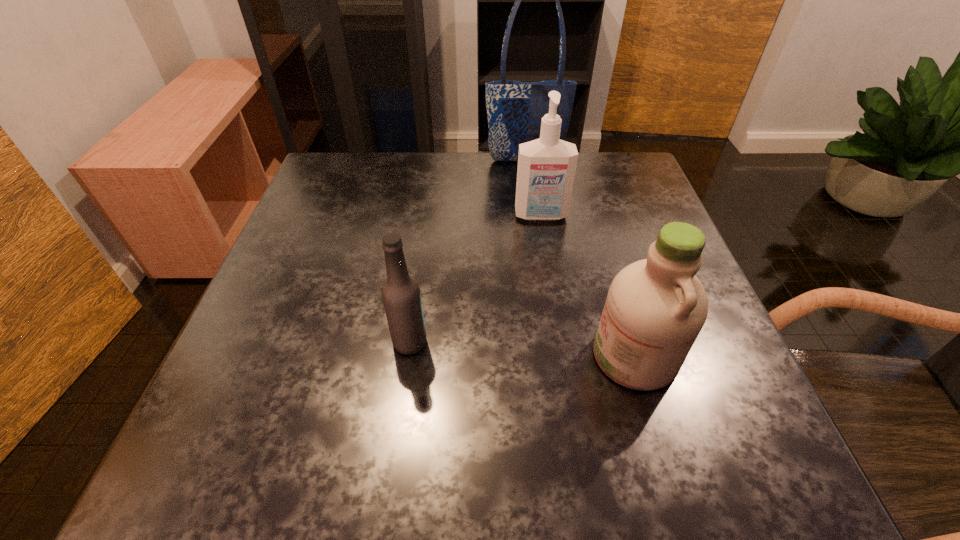
The image size is (960, 540). Find the location of `vacant space positioned 0.290m on the label of the leftmost object`. vacant space positioned 0.290m on the label of the leftmost object is located at coordinates (599, 342).

At what (x,y) coordinates should I click in order to perform the action: click on object present at the far edge. Please return your answer as a coordinate pair (x, y). The width and height of the screenshot is (960, 540). Looking at the image, I should click on (515, 109).

Find the location of a particular element. This screenshot has width=960, height=540. object at the right edge is located at coordinates (656, 307).

Where is `free space at the far edge`? This screenshot has width=960, height=540. free space at the far edge is located at coordinates (501, 166).

Identify the location of vacant space at the near edge of the desktop. This screenshot has width=960, height=540. (320, 425).

Find the location of a particular element. vacant space at the left edge of the desktop is located at coordinates (278, 277).

The width and height of the screenshot is (960, 540). I want to click on vacant space at the right edge of the desktop, so click(607, 227).

In order to click on vacant space at the far left corner of the desktop in this screenshot , I will do `click(384, 161)`.

The height and width of the screenshot is (540, 960). Find the location of `free point at the near left corner`. free point at the near left corner is located at coordinates (282, 475).

Locate an element on the screen. The width and height of the screenshot is (960, 540). free space at the near right corner of the desktop is located at coordinates (707, 483).